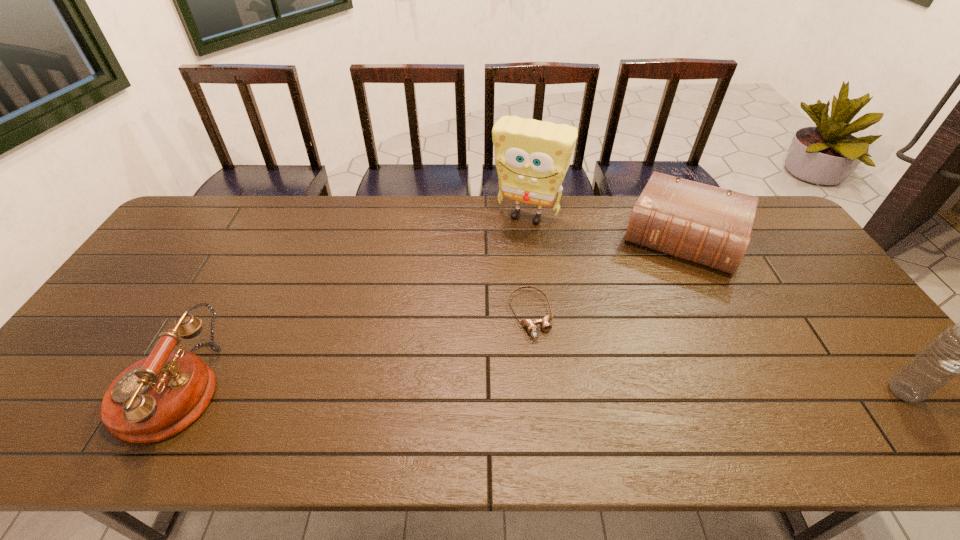
Identify the location of Bible that is positioned at the far edge. The width and height of the screenshot is (960, 540). (710, 226).

Image resolution: width=960 pixels, height=540 pixels. Find the location of `sponge that is at the far edge`. sponge that is at the far edge is located at coordinates (532, 157).

Where is `telephone present at the near edge`? telephone present at the near edge is located at coordinates (157, 397).

Locate an element on the screen. The height and width of the screenshot is (540, 960). water bottle at the near edge is located at coordinates [959, 350].

Identify the location of water bottle that is positioned at the right edge. (959, 350).

This screenshot has height=540, width=960. What are the coordinates of `Bible situated at the right edge` in the screenshot? It's located at (710, 226).

You are a GUI agent. You are given a task and a screenshot of the screen. Output one action in this format:
    pyautogui.click(x=<x>, y=<y>)
    Task: Click on the object that is at the far right corner
    Image resolution: width=960 pixels, height=540 pixels.
    Given the screenshot: What is the action you would take?
    pyautogui.click(x=710, y=226)

Identify the location of object that is at the near right corner. The image size is (960, 540). (959, 350).

The image size is (960, 540). In the image, there is a desktop. What are the coordinates of `vacant space at the far edge` in the screenshot? It's located at (600, 212).

This screenshot has height=540, width=960. What are the coordinates of `vacant space at the near edge` in the screenshot? It's located at (306, 383).